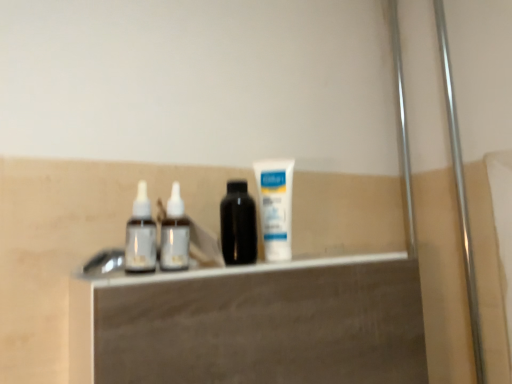
Question: From the image's perspective, relative to white glossy vanity at center, is white matte tube at center above or below?

Choices:
 (A) above
 (B) below

Answer: (A)

Question: From a real-world perspective, is white matte tube at center positioned above or below white glossy vanity at center?

Choices:
 (A) above
 (B) below

Answer: (A)

Question: Does point (272, 193) appear closer or farther from the camera than point (282, 288)?

Choices:
 (A) farther
 (B) closer

Answer: (A)

Question: Considering the positions of white glossy vanity at center and white matte tube at center in the image, is white glossy vanity at center bigger or smaller than white matte tube at center?

Choices:
 (A) big
 (B) small

Answer: (A)

Question: From the image's perspective, relative to white matte tube at center, is white glossy vanity at center above or below?

Choices:
 (A) below
 (B) above

Answer: (A)

Question: From a real-world perspective, is white glossy vanity at center physically located above or below white matte tube at center?

Choices:
 (A) below
 (B) above

Answer: (A)

Question: Considering the positions of point (86, 296) and point (269, 170), is point (86, 296) closer or farther from the camera than point (269, 170)?

Choices:
 (A) closer
 (B) farther

Answer: (A)